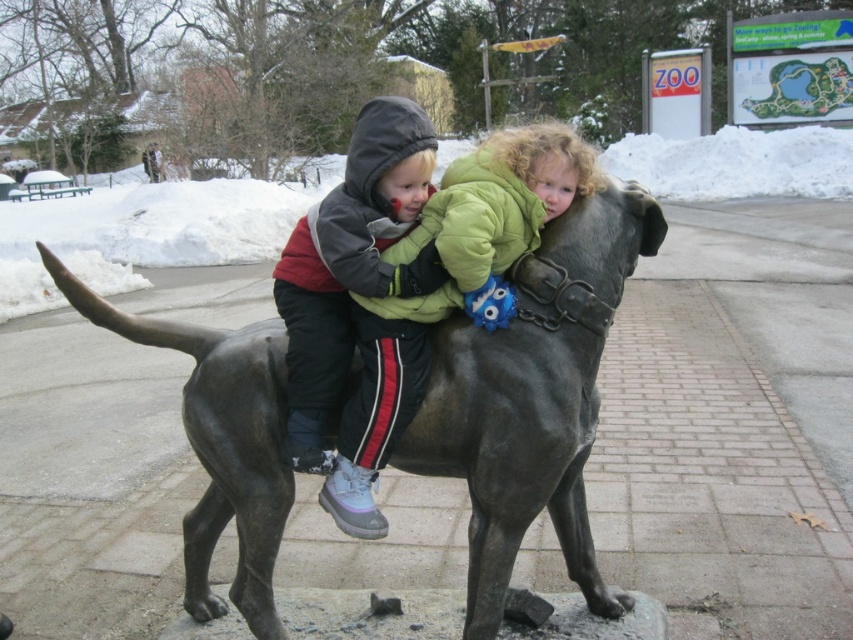
Between white fluffy snow at upper center and green fleece jacket at center, which one appears on the left side from the viewer's perspective?

green fleece jacket at center

Which is behind, point (283, 225) or point (575, 138)?

Positioned behind is point (283, 225).

Locate an element on the screen. white fluffy snow at upper center is located at coordinates (144, 232).

Is white fluffy snow at upper center taller than matte black jacket at center?

Correct, white fluffy snow at upper center is much taller as matte black jacket at center.

Locate an element on the screen. Image resolution: width=853 pixels, height=640 pixels. white fluffy snow at upper center is located at coordinates (144, 232).

The width and height of the screenshot is (853, 640). I want to click on white fluffy snow at upper center, so point(144,232).

Does point (469, 483) come behind point (428, 177)?

No, (469, 483) is closer to viewer.

Between bronze statue at center and matte black jacket at center, which one is positioned higher?

Positioned higher is matte black jacket at center.

You are a GUI agent. You are given a task and a screenshot of the screen. Output one action in this format:
    pyautogui.click(x=<x>, y=<y>)
    Task: Click on the bronze statue at center
    This screenshot has width=853, height=640.
    Given the screenshot: What is the action you would take?
    pyautogui.click(x=505, y=378)

At what (x,y) coordinates should I click in order to perform the action: click on bronze statue at center. Please return your answer as a coordinate pair (x, y). The height and width of the screenshot is (640, 853). Looking at the image, I should click on (505, 378).